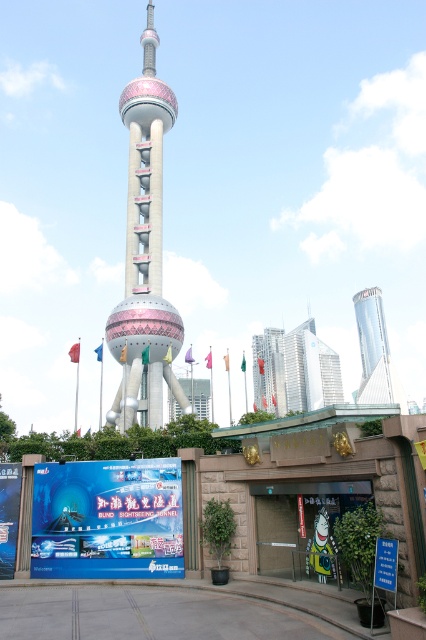
Question: Which is nearer to the blue glossy billboard at lower center?

Choices:
 (A) glassy reflective skyscraper at center
 (B) polished concrete tower at center
 (C) silver metallic skyscraper at center

Answer: (B)

Question: Can you confirm if polished concrete tower at center is thinner than glassy reflective skyscraper at center?

Choices:
 (A) yes
 (B) no

Answer: (A)

Question: Where is polished concrete tower at center located in relation to silver metallic skyscraper at center in the image?

Choices:
 (A) above
 (B) below

Answer: (A)

Question: Which of the following is the farthest from the observer?

Choices:
 (A) blue glossy billboard at center
 (B) silver metallic skyscraper at center
 (C) blue glossy billboard at lower center
 (D) glassy reflective skyscraper at center

Answer: (B)

Question: Among these objects, which one is farthest from the camera?

Choices:
 (A) blue glossy billboard at lower center
 (B) polished concrete tower at center

Answer: (B)

Question: Is polished concrete tower at center below glassy reflective skyscraper at center?

Choices:
 (A) yes
 (B) no

Answer: (B)